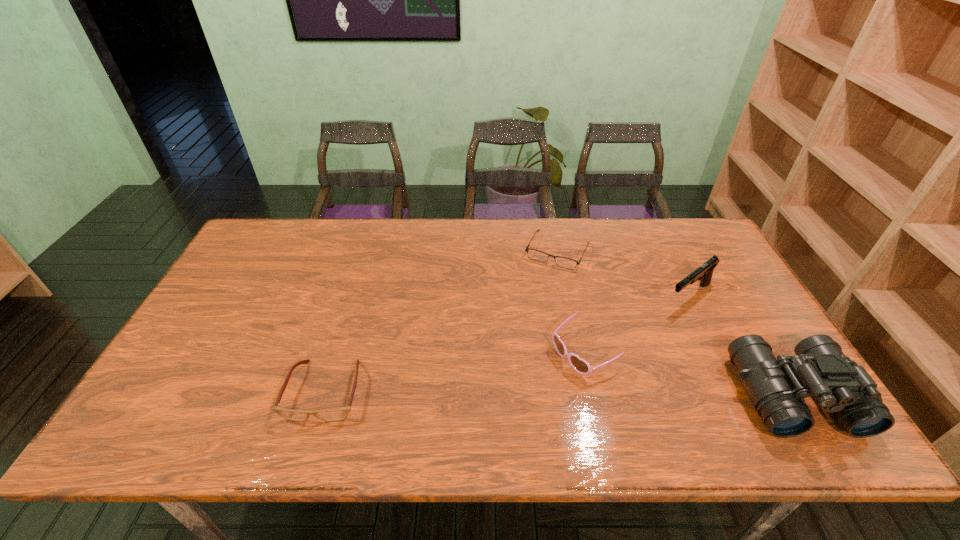
Locate an element on the screen. This screenshot has width=960, height=540. free spot on the desktop that is between the fourth tallest object and the binoculars and is positioned at the aiming end of the second farthest object is located at coordinates (566, 393).

Where is `free space on the desktop that is between the nearer spectacles and the binoculars and is positioned on the front-facing side of the shorter spectacles`? The image size is (960, 540). free space on the desktop that is between the nearer spectacles and the binoculars and is positioned on the front-facing side of the shorter spectacles is located at coordinates (490, 392).

This screenshot has width=960, height=540. In order to click on vacant space on the desktop that is between the nearer spectacles and the binoculars and is positioned on the front-facing side of the sunglasses in this screenshot , I will do `click(519, 393)`.